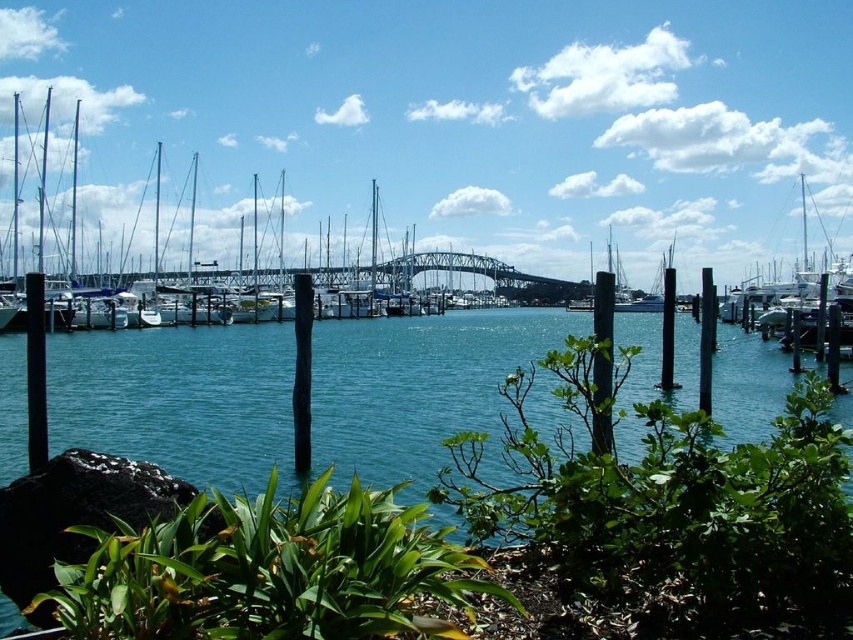
Is black matte pole at left to the left of black wood post at center from the viewer's perspective?

Indeed, black matte pole at left is positioned on the left side of black wood post at center.

Between black matte pole at left and black wood post at center, which one has more height?

black matte pole at left

This screenshot has width=853, height=640. I want to click on black matte pole at left, so click(x=35, y=371).

This screenshot has width=853, height=640. What are the coordinates of `black matte pole at left` in the screenshot? It's located at (35, 371).

Looking at this image, can you confirm if clear blue water at center is positioned below metallic silver sailboat at right?

Correct, clear blue water at center is located below metallic silver sailboat at right.

Who is more forward, (444, 355) or (781, 294)?

Positioned in front is point (444, 355).

At what (x,y) coordinates should I click in order to perform the action: click on clear blue water at center. Please return your answer as a coordinate pair (x, y). The height and width of the screenshot is (640, 853). Looking at the image, I should click on (178, 400).

Can you confirm if metallic silver sailboat at right is wider than black matte pole at left?

Correct, the width of metallic silver sailboat at right exceeds that of black matte pole at left.

Who is positioned more to the left, metallic silver sailboat at right or black matte pole at left?

black matte pole at left

This screenshot has width=853, height=640. In order to click on metallic silver sailboat at right in this screenshot , I will do `click(782, 292)`.